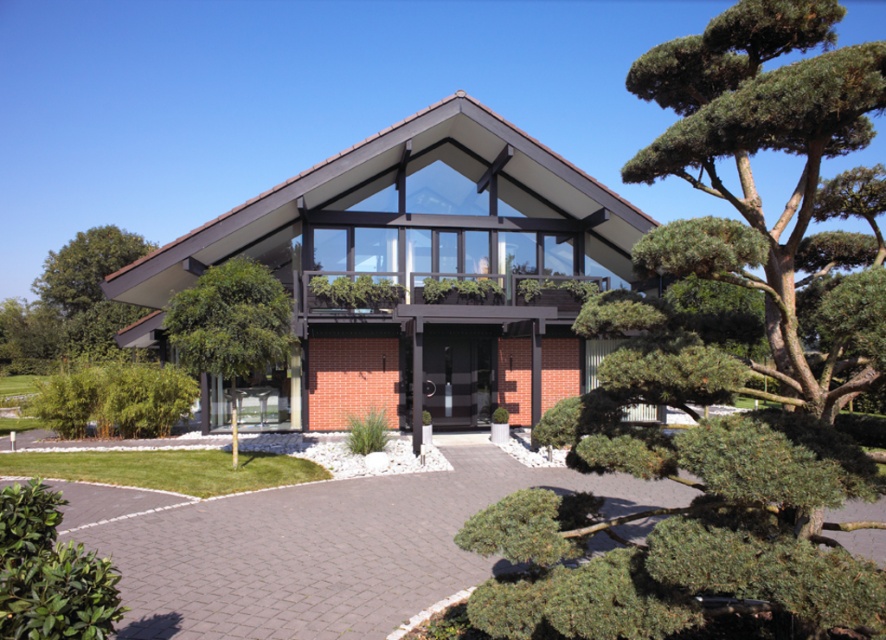
You are standing at the entrance of the building and want to water the green textured tree at right. The watering hose you have can reach up to 3 meters. Do you think you can water the tree without moving the hose nozzle?

The green textured tree at right is 2.83 meters from viewer, so yes, the hose can reach it since 2.83 meters is within the 3 meters maximum reach.